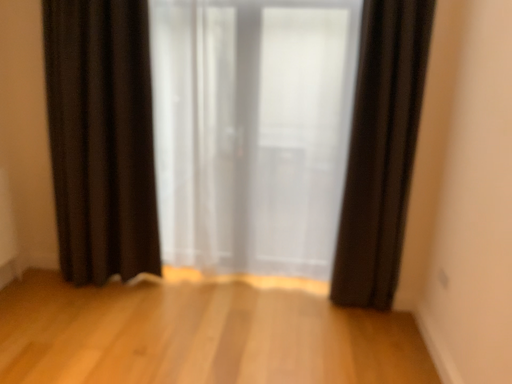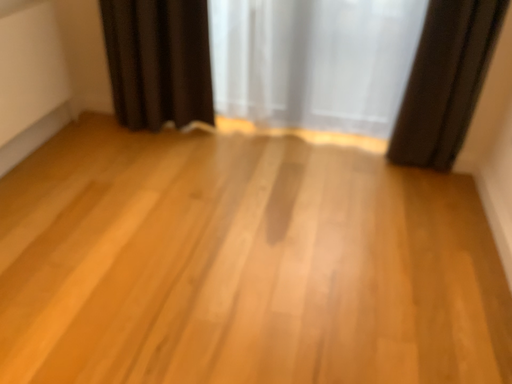
Question: How did the camera likely rotate when shooting the video?

Choices:
 (A) rotated downward
 (B) rotated upward

Answer: (A)